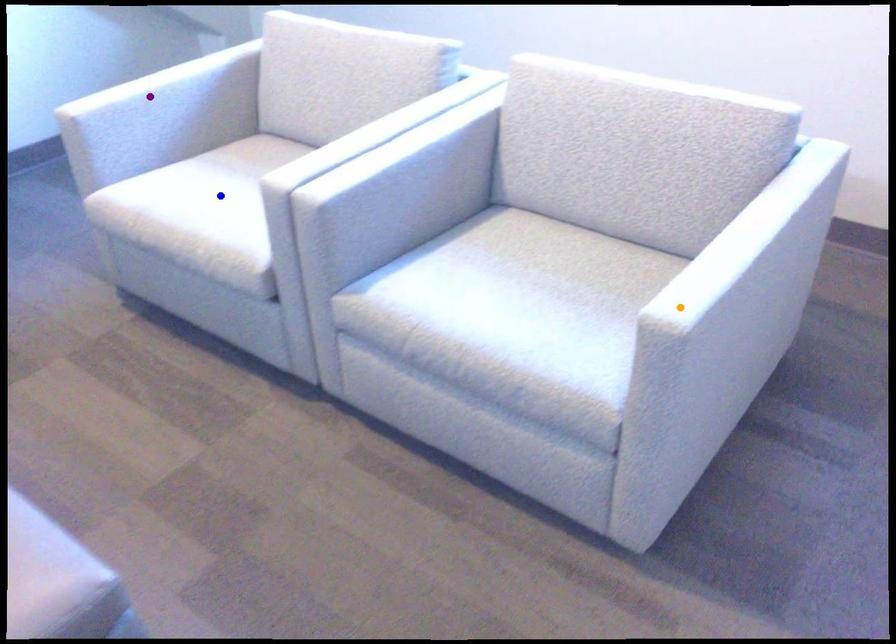
Order these from nearest to farthest:
purple point | blue point | orange point

orange point → blue point → purple point